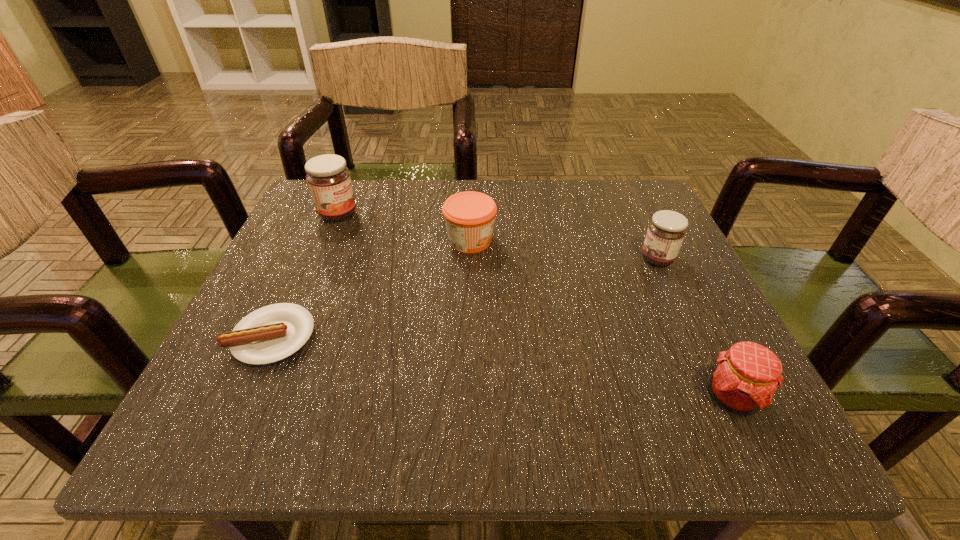
Image resolution: width=960 pixels, height=540 pixels. In order to click on object located in the near edge section of the desktop in this screenshot , I will do `click(745, 378)`.

Locate an element on the screen. jam that is positioned at the left edge is located at coordinates (329, 181).

Locate an element on the screen. This screenshot has height=540, width=960. sausage that is at the left edge is located at coordinates (272, 333).

Locate an element on the screen. The width and height of the screenshot is (960, 540). object at the far left corner is located at coordinates (329, 181).

This screenshot has height=540, width=960. What are the coordinates of `object located at the near right corner` in the screenshot? It's located at (745, 378).

In the image, there is a desktop. Identify the location of vacant space at the far edge. The image size is (960, 540). (440, 232).

I want to click on free region at the near edge of the desktop, so click(358, 397).

Locate an element on the screen. Image resolution: width=960 pixels, height=540 pixels. free space at the left edge of the desktop is located at coordinates (x=296, y=256).

The width and height of the screenshot is (960, 540). In the image, there is a desktop. In order to click on vacant area at the right edge in this screenshot , I will do `click(642, 328)`.

Identify the location of free region at the far left corner of the desktop. This screenshot has width=960, height=540. (371, 223).